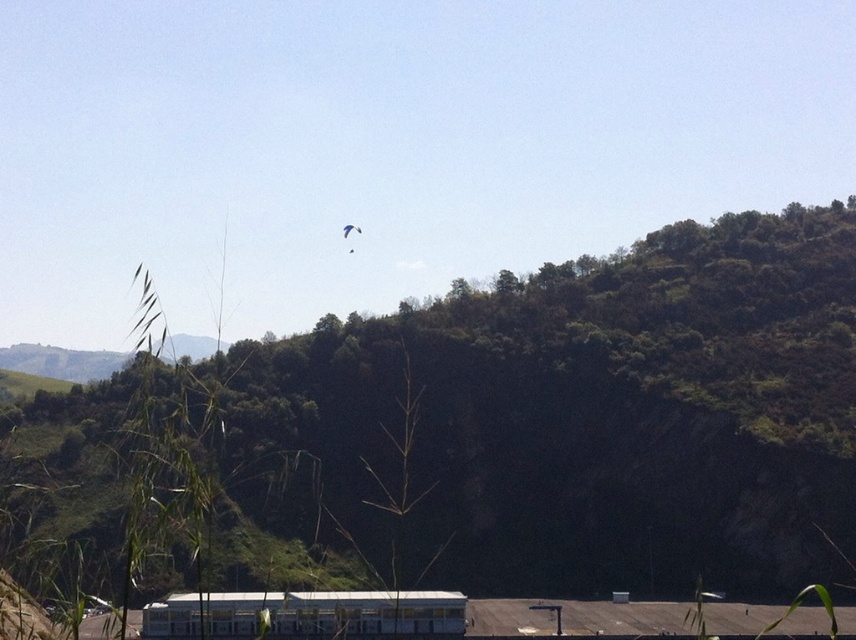
You are standing at the point with coordinates point (180, 625) and want to walk towards the point with coordinates point (218, 378). Will the building partially visible at the bottom edge of the frame block your path?

Point (218, 378) is behind point (180, 625), so the building partially visible at the bottom edge of the frame will block your path to point (218, 378).

You are standing at the base of the hill and want to take a photo of the green leafy tree at upper center. If your camera can focus on objects up to 40 feet away, will you be able to capture a clear image of the tree?

The green leafy tree at upper center is 37.49 feet from the camera, which is within the camera focus range of up to 40 feet. Therefore, you can capture a clear image of the tree.